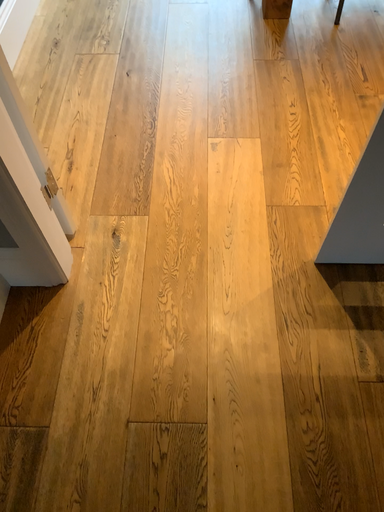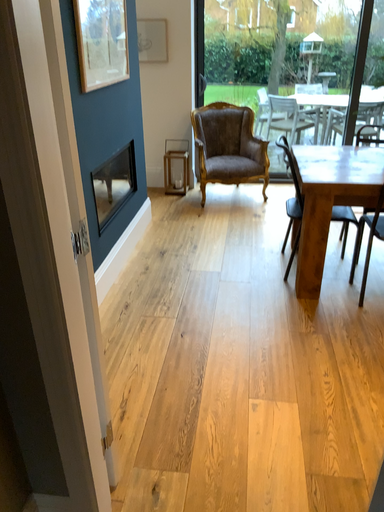
Question: How did the camera likely rotate when shooting the video?

Choices:
 (A) rotated upward
 (B) rotated downward

Answer: (A)